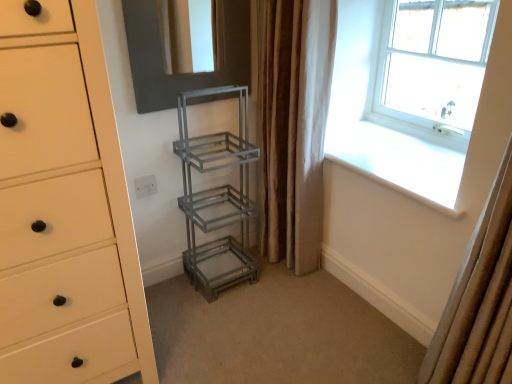
Where is `vacant area that is in front of metallic gray shelf at center`? This screenshot has width=512, height=384. vacant area that is in front of metallic gray shelf at center is located at coordinates (222, 314).